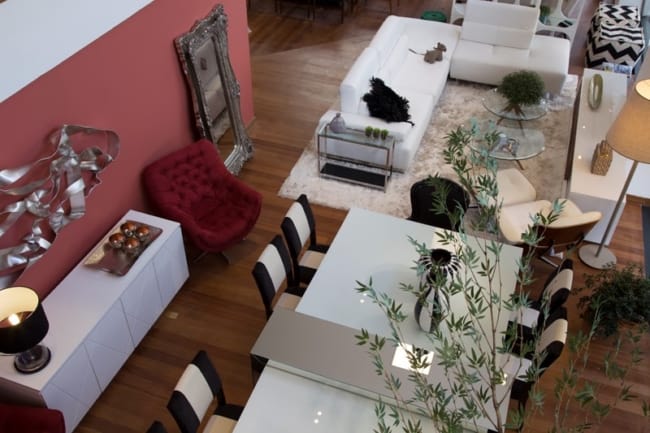
Identify the location of dark brown flooring. (294, 105), (231, 287), (613, 400).